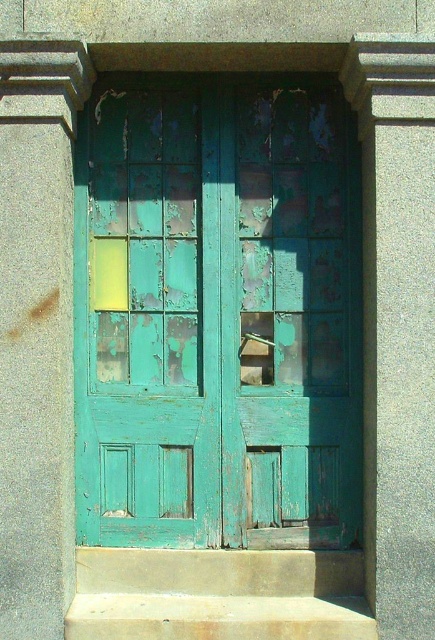
You are a painter hired to restore the peeling teal wood door at center and the concrete steps at center. Given that the door is larger than the steps, which object will require more paint to cover its surface area?

The peeling teal wood door at center requires more paint because it is larger in size than the concrete steps at center, resulting in a greater surface area to cover.

You are standing in front of the peeling teal wood door at center and want to go up the concrete steps at center. Can you walk directly to the steps without moving around the door?

The concrete steps at center is behind peeling teal wood door at center, so you can walk directly to the steps without needing to move around the door since they are positioned behind it.

You are standing in front of a weathered double door. You notice a peeling teal wood door at center. Can you determine its exact position relative to the center of the frame?

The peeling teal wood door at center is located exactly at the center of the frame, as its coordinates are approximately 0.492 on the x and 0.501 on the y axis, which are very close to 0.5, indicating the center point.